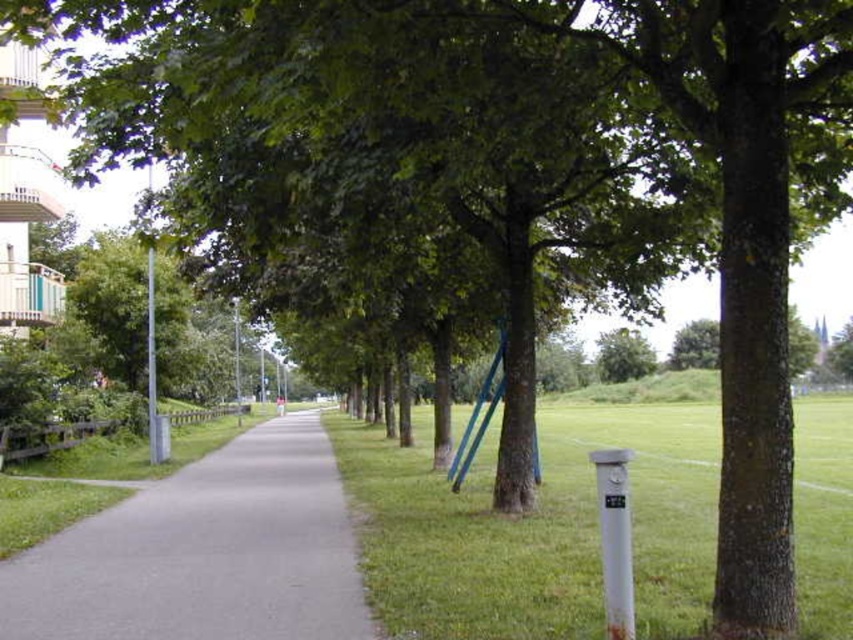
You are a gardener who needs to mow the green grass at center and trim the green leafy tree at center. Which task should you do first if you want to tackle the taller object first?

The green leafy tree at center is taller than the green grass at center, so you should trim the green leafy tree at center first.